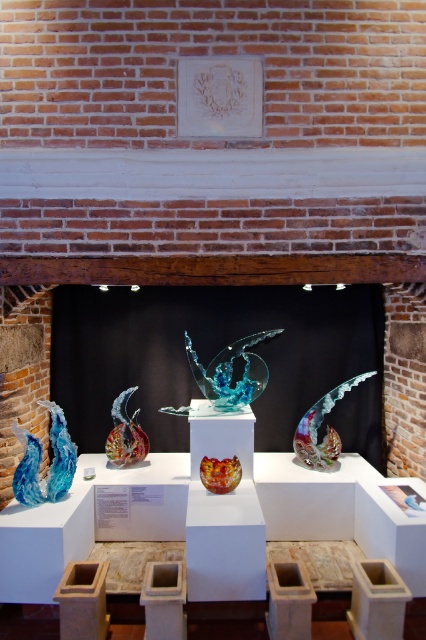
Question: Observing the image, what is the correct spatial positioning of translucent glass sculpture at right in reference to translucent amber glass bowl at center?

Choices:
 (A) below
 (B) above

Answer: (B)

Question: Which of the following is the closest to the observer?

Choices:
 (A) (256, 358)
 (B) (345, 390)

Answer: (B)

Question: In this image, where is translucent blue glass sculpture at left located relative to translucent glass fish at center?

Choices:
 (A) left
 (B) right

Answer: (A)

Question: Does translucent blue glass sculpture at left have a larger size compared to translucent glass fish at center?

Choices:
 (A) no
 (B) yes

Answer: (B)

Question: Estimate the real-world distances between objects in this image. Which object is closer to the translucent blue glass sculpture at left?

Choices:
 (A) translucent glass fish at center
 (B) translucent amber glass bowl at center

Answer: (B)

Question: Which point is farther to the camera?

Choices:
 (A) translucent amber glass bowl at center
 (B) translucent blue glass sculpture at left
 (C) translucent glass sculpture at right

Answer: (C)